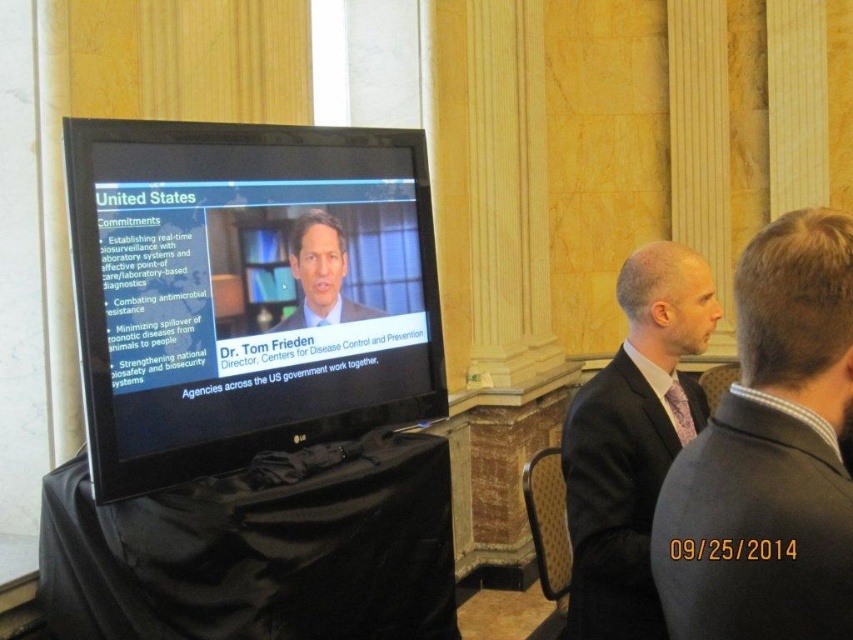
You are a photographer preparing to take a group photo of the individuals in the formal setting. You notice two suits at the center of the scene. The dark gray wool suit at center and the blue suit at center. Given that your camera frame can only accommodate one of the suits in the center, which suit should you prioritize to ensure it fits properly within the frame?

The dark gray wool suit at center should be prioritized because its width surpasses that of the blue suit at center, meaning it requires more space to fit properly within the camera frame.

You are attending a meeting in this formal setting and notice two individuals wearing suits. The dark gray suit at center and the blue suit at center. Which one is closer to you?

The dark gray suit at center is closer to you since it is in front of the blue suit at center.

What is the position of the point labeled with coordinates (247, 291) in the image?

The point labeled with coordinates (247, 291) is located on the black glossy monitor at center.